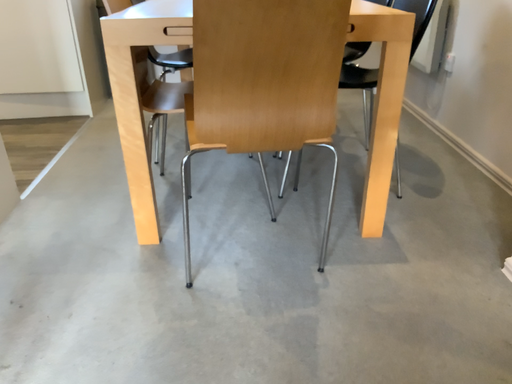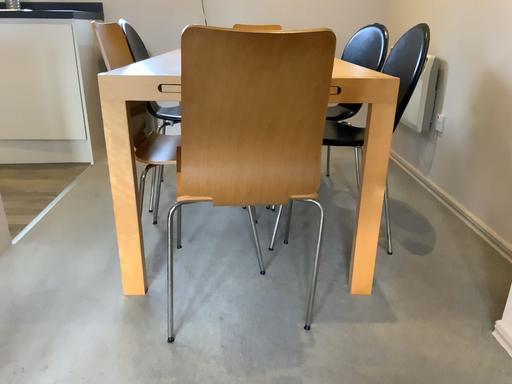
Question: Which way did the camera rotate in the video?

Choices:
 (A) rotated upward
 (B) rotated downward

Answer: (A)